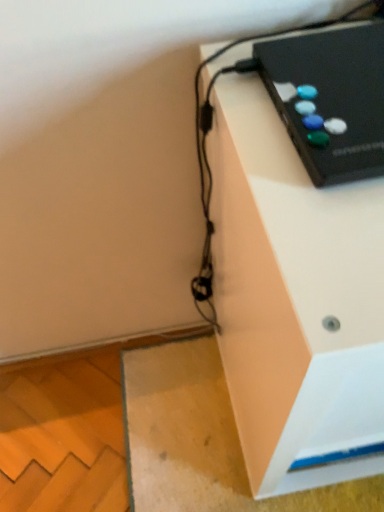
This screenshot has height=512, width=384. Identify the location of free point above black plastic gamepad at upper right (from a real-world perspective). (340, 62).